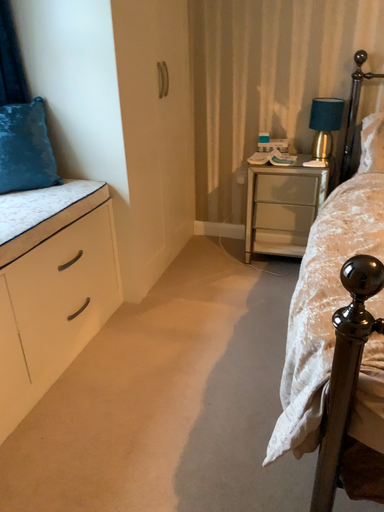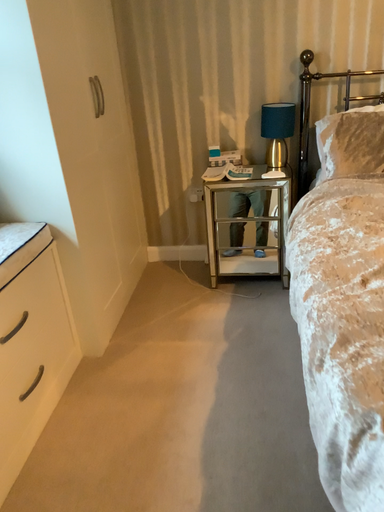
Question: Which way did the camera rotate in the video?

Choices:
 (A) rotated right
 (B) rotated left

Answer: (A)